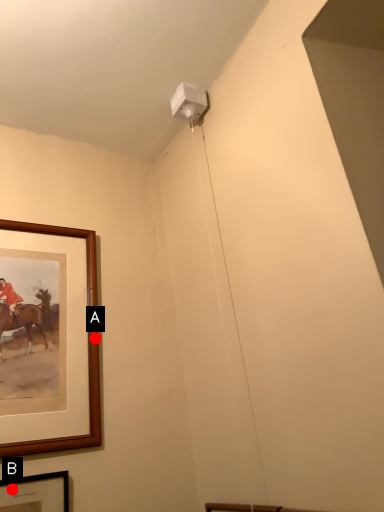
Question: Two points are circled on the image, labeled by A and B beside each circle. Which point is further to the camera?

Choices:
 (A) A is further
 (B) B is further

Answer: (A)